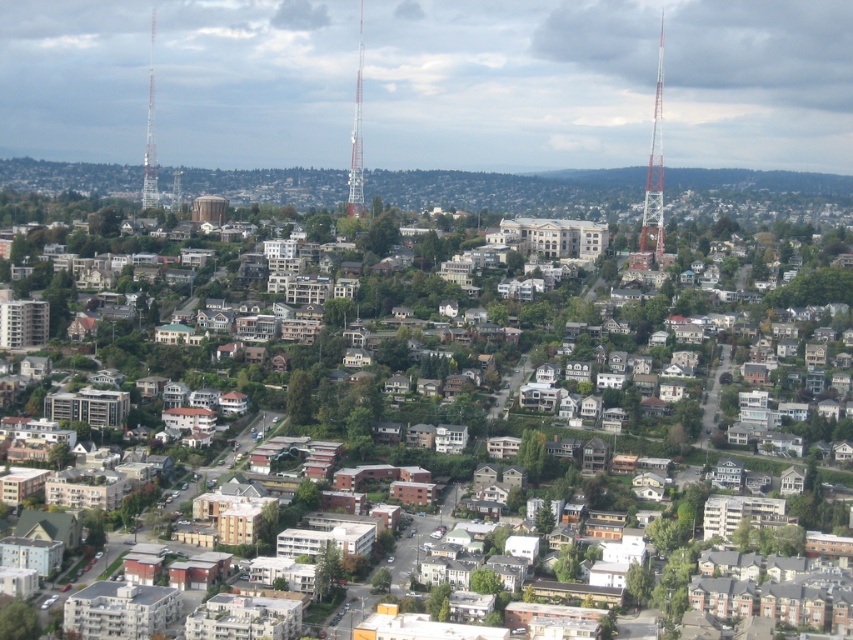
Question: Which object is positioned closest to the metallic silver tower at left?

Choices:
 (A) white painted metal tower at center
 (B) red painted metal tower at right

Answer: (A)

Question: Does white painted metal tower at center have a smaller size compared to metallic silver tower at left?

Choices:
 (A) no
 (B) yes

Answer: (A)

Question: Which of the following is the closest to the observer?

Choices:
 (A) (149, 104)
 (B) (360, 45)
 (C) (647, 173)

Answer: (B)

Question: Is red painted metal tower at right bigger than white painted metal tower at center?

Choices:
 (A) no
 (B) yes

Answer: (B)

Question: Which object appears farthest from the camera in this image?

Choices:
 (A) metallic silver tower at left
 (B) red painted metal tower at right
 (C) white painted metal tower at center

Answer: (A)

Question: Can you confirm if white painted metal tower at center is positioned to the right of metallic silver tower at left?

Choices:
 (A) yes
 (B) no

Answer: (A)